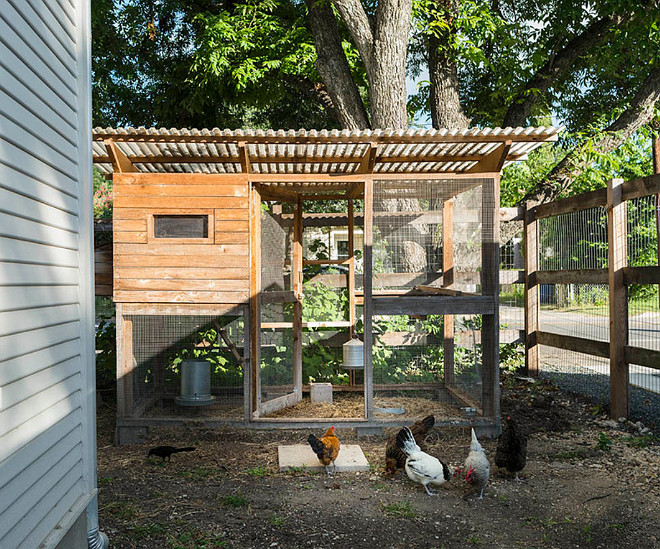
The width and height of the screenshot is (660, 549). I want to click on house wall, so click(59, 264).